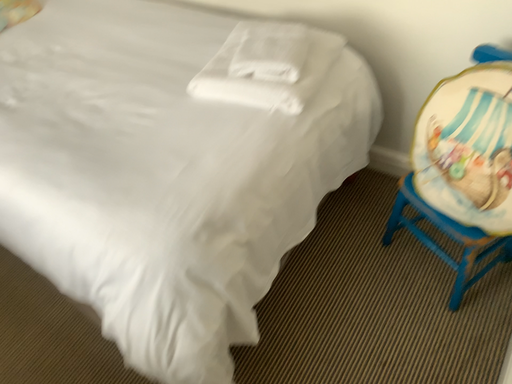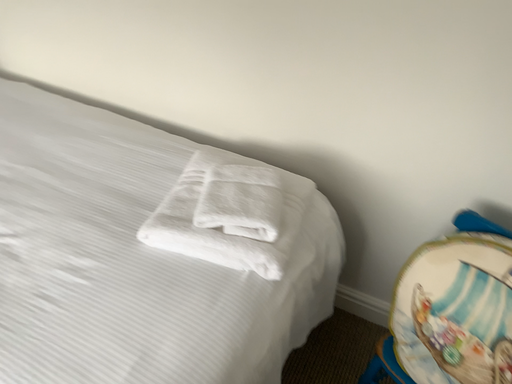
Question: Which way did the camera rotate in the video?

Choices:
 (A) rotated left
 (B) rotated right

Answer: (B)